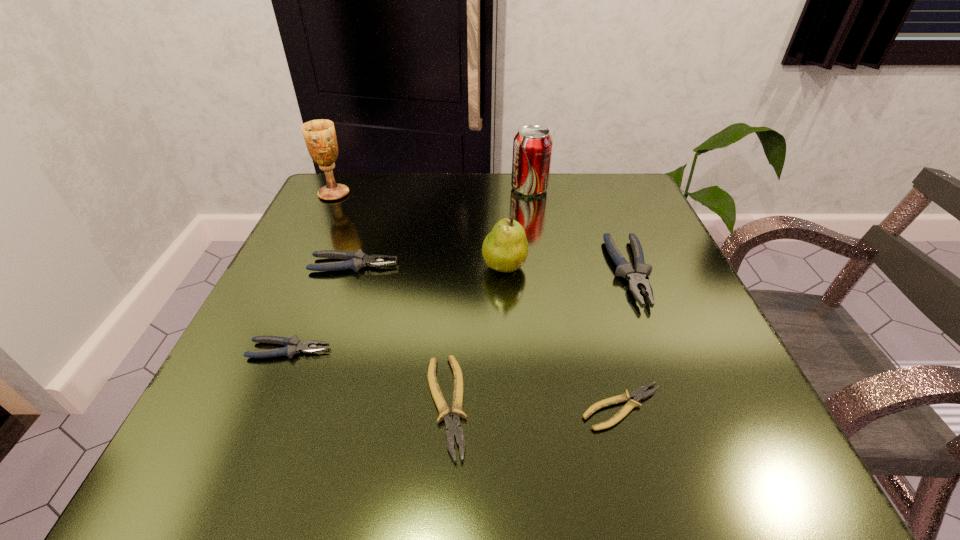
Locate an element on the screen. The width and height of the screenshot is (960, 540). vacant space situated on the back of the shortest object is located at coordinates (597, 316).

You are a GUI agent. You are given a task and a screenshot of the screen. Output one action in this format:
    pyautogui.click(x=<x>, y=<y>)
    Task: Click on the chalice at the far edge
    Image resolution: width=960 pixels, height=540 pixels.
    Given the screenshot: What is the action you would take?
    (x=320, y=137)

The width and height of the screenshot is (960, 540). What are the coordinates of `soda can located in the far edge section of the desktop` in the screenshot? It's located at (532, 146).

Find the location of a particular element. This screenshot has height=540, width=960. chalice that is at the left edge is located at coordinates (320, 137).

I want to click on object that is positioned at the far left corner, so click(x=320, y=137).

Locate an element on the screen. object located in the near right corner section of the desktop is located at coordinates (638, 395).

Find the location of `free region at the far edge of the desktop`. free region at the far edge of the desktop is located at coordinates (555, 207).

In the image, there is a desktop. Where is `free space at the left edge`? free space at the left edge is located at coordinates (245, 390).

This screenshot has width=960, height=540. I want to click on vacant space at the right edge, so [616, 240].

At what (x,y) coordinates should I click in order to perform the action: click on vacant space at the far left corner of the desktop. Please return your answer as a coordinate pair (x, y). The width and height of the screenshot is (960, 540). Looking at the image, I should click on (373, 214).